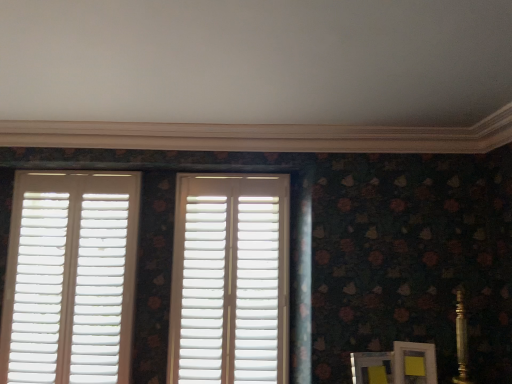
Question: Which direction should I rotate to face white matte shutters at center, arranged as the first window when viewed from the right, — up or down?

Choices:
 (A) down
 (B) up

Answer: (A)

Question: Considering the relative positions of white matte shutters at left, the 1th window viewed from the left, and white matte shutters at center, the second window viewed from the left, in the image provided, is white matte shutters at left, the 1th window viewed from the left, in front of white matte shutters at center, the second window viewed from the left,?

Choices:
 (A) yes
 (B) no

Answer: (B)

Question: Is white matte shutters at left, positioned as the 2th window in right-to-left order, touching white matte shutters at center, the second window viewed from the left?

Choices:
 (A) yes
 (B) no

Answer: (B)

Question: From a real-world perspective, is white matte shutters at left, the 1th window viewed from the left, positioned over white matte shutters at center, arranged as the first window when viewed from the right, based on gravity?

Choices:
 (A) no
 (B) yes

Answer: (A)

Question: Is white matte shutters at left, the 1th window viewed from the left, wider than white matte shutters at center, arranged as the first window when viewed from the right?

Choices:
 (A) no
 (B) yes

Answer: (B)

Question: Can you confirm if white matte shutters at left, the 1th window viewed from the left, is bigger than white matte shutters at center, the second window viewed from the left?

Choices:
 (A) no
 (B) yes

Answer: (B)

Question: Is white matte shutters at left, the 1th window viewed from the left, facing towards white matte shutters at center, the second window viewed from the left?

Choices:
 (A) yes
 (B) no

Answer: (B)

Question: Does white matte shutters at center, arranged as the first window when viewed from the right, come in front of white matte shutters at left, positioned as the 2th window in right-to-left order?

Choices:
 (A) yes
 (B) no

Answer: (A)

Question: From a real-world perspective, does white matte shutters at center, the second window viewed from the left, stand above white matte shutters at left, positioned as the 2th window in right-to-left order?

Choices:
 (A) no
 (B) yes

Answer: (B)

Question: Does white matte shutters at center, arranged as the first window when viewed from the right, have a greater width compared to white matte shutters at left, positioned as the 2th window in right-to-left order?

Choices:
 (A) yes
 (B) no

Answer: (B)

Question: Is white matte shutters at center, arranged as the first window when viewed from the right, next to white matte shutters at left, positioned as the 2th window in right-to-left order?

Choices:
 (A) yes
 (B) no

Answer: (B)

Question: Is white matte shutters at center, the second window viewed from the left, at the right side of white matte shutters at left, the 1th window viewed from the left?

Choices:
 (A) no
 (B) yes

Answer: (B)

Question: Can you confirm if white matte shutters at center, the second window viewed from the left, is taller than white matte shutters at left, positioned as the 2th window in right-to-left order?

Choices:
 (A) yes
 (B) no

Answer: (B)

Question: Considering the positions of white matte shutters at left, the 1th window viewed from the left, and white matte shutters at center, the second window viewed from the left, in the image, is white matte shutters at left, the 1th window viewed from the left, wider or thinner than white matte shutters at center, the second window viewed from the left,?

Choices:
 (A) thin
 (B) wide

Answer: (B)